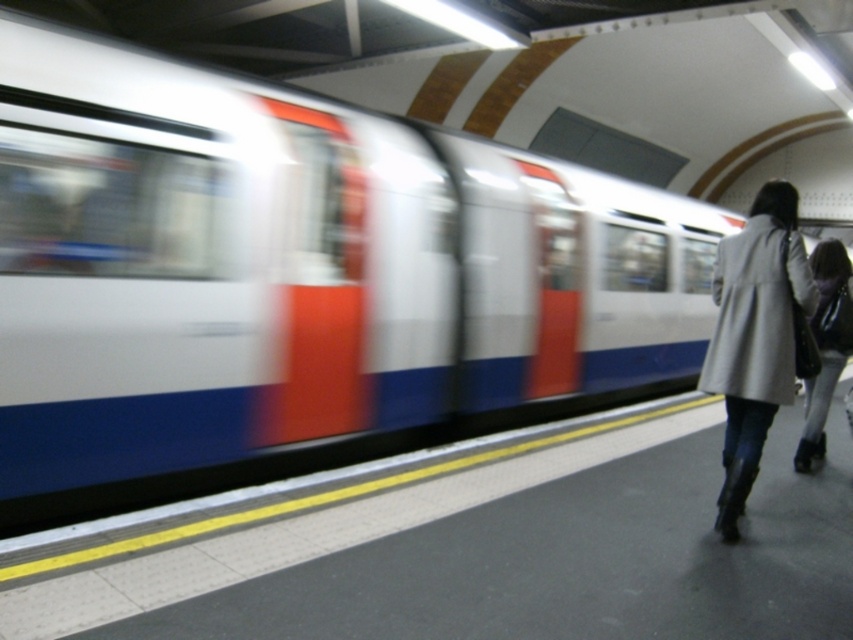
How much distance is there between gray wool coat at right and matte gray coat at right?

gray wool coat at right is 1.54 meters away from matte gray coat at right.

Is gray wool coat at right in front of matte gray coat at right?

Yes, gray wool coat at right is closer to the viewer.

Is point (709, 364) positioned before point (833, 372)?

That is True.

Identify the location of gray wool coat at right. This screenshot has height=640, width=853. (753, 336).